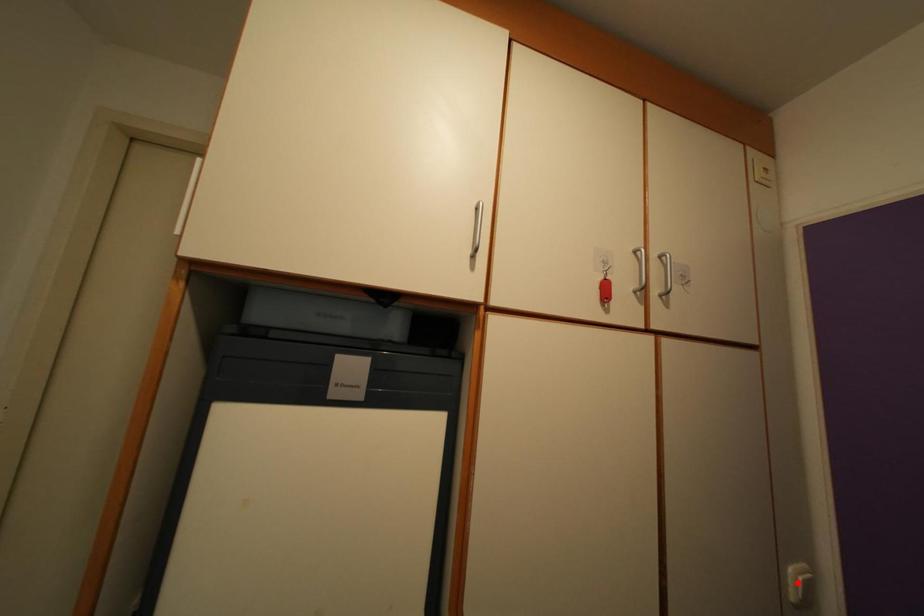
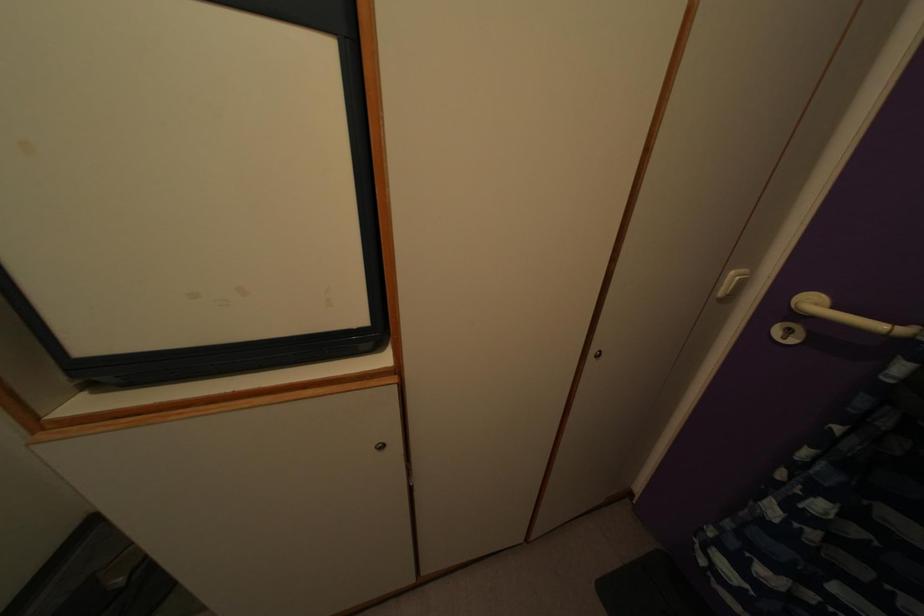
Locate, in the second image, the point that corresponds to the highlighted location in the first image.

(736, 284)